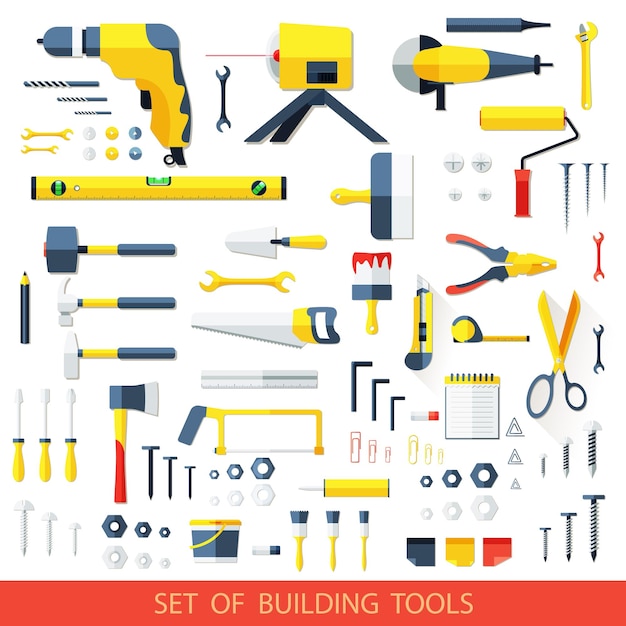
This screenshot has width=626, height=626. I want to click on washers, so click(91, 133), click(91, 151), click(111, 131), click(111, 154), click(136, 155), click(136, 131).